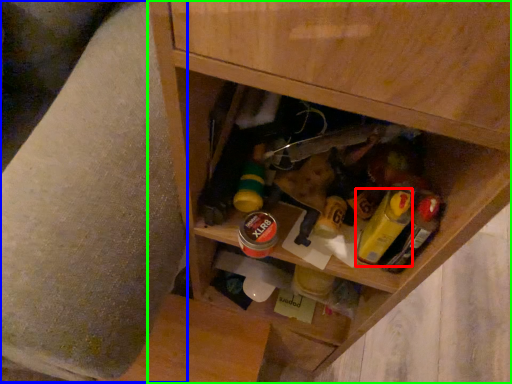
Question: Estimate the real-world distances between objects in this image. Which object is closer to mustard (highlighted by a red box), swivel chair (highlighted by a blue box) or cabinetry (highlighted by a green box)?

Choices:
 (A) swivel chair
 (B) cabinetry

Answer: (B)